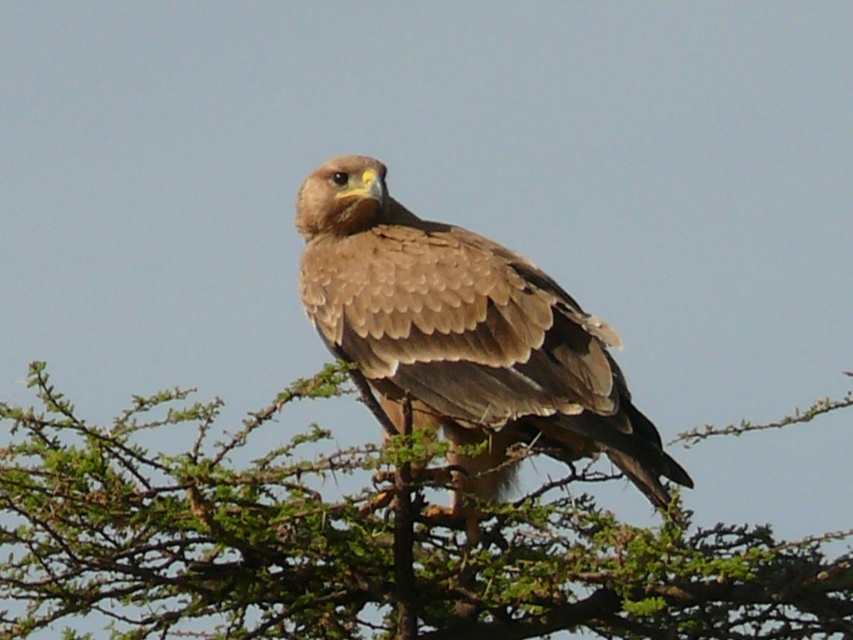
Can you confirm if green leafy tree at center is positioned above brown feathered eagle at center?

Actually, green leafy tree at center is below brown feathered eagle at center.

Is green leafy tree at center wider than brown feathered eagle at center?

Indeed, green leafy tree at center has a greater width compared to brown feathered eagle at center.

Is point (531, 609) less distant than point (619, 416)?

That is False.

The width and height of the screenshot is (853, 640). What are the coordinates of `green leafy tree at center` in the screenshot? It's located at (360, 547).